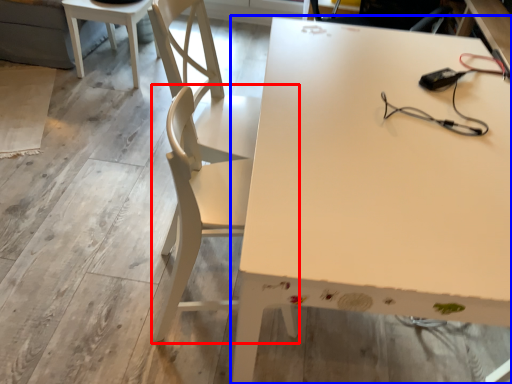
Question: Which of the following is the closest to the observer, chair (highlighted by a red box) or table (highlighted by a blue box)?

Choices:
 (A) chair
 (B) table

Answer: (B)